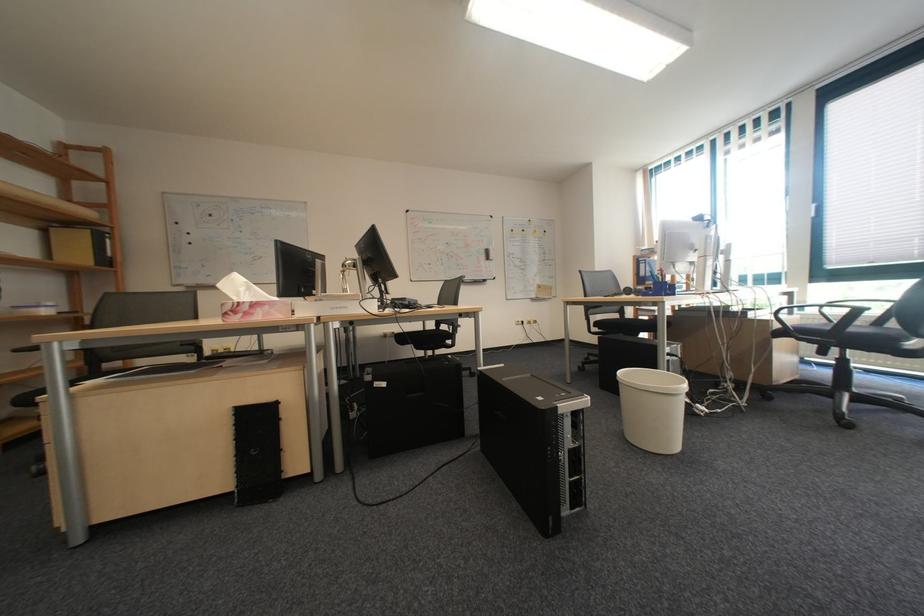
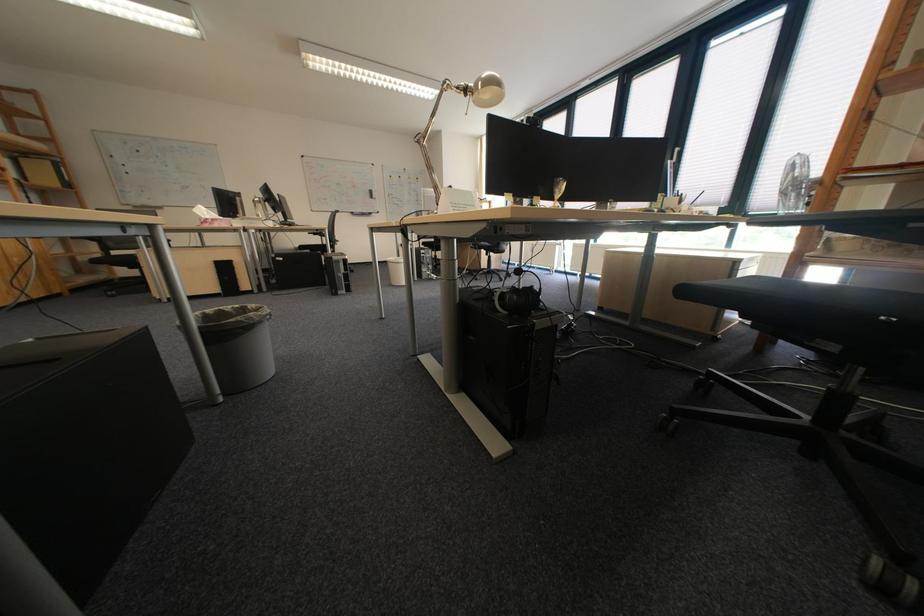
In a continuous first-person perspective shot, in which direction is the camera moving?

The cameraman moved toward right, backward.